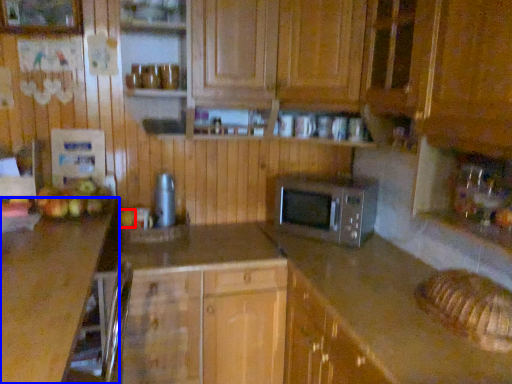
Question: Which object is closer to the camera taking this photo, apple (highlighted by a red box) or countertop (highlighted by a blue box)?

Choices:
 (A) apple
 (B) countertop

Answer: (B)